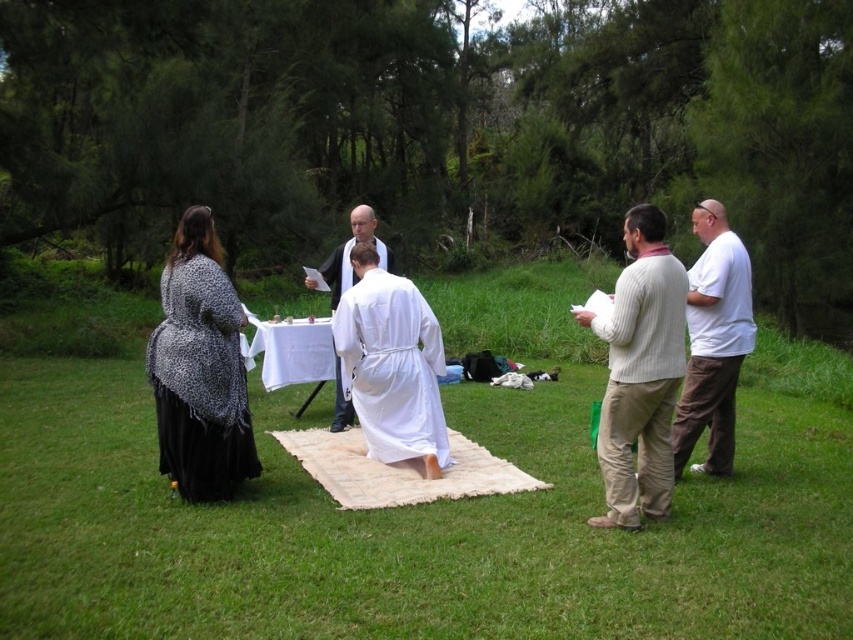
Can you confirm if white silk robe at center is wider than white clothed figure at center?

Indeed, white silk robe at center has a greater width compared to white clothed figure at center.

Can you confirm if white silk robe at center is bigger than white clothed figure at center?

Actually, white silk robe at center might be smaller than white clothed figure at center.

Is point (399, 356) positioned after point (372, 225)?

No, (399, 356) is in front of (372, 225).

Find the location of a particular element. This screenshot has width=853, height=640. white silk robe at center is located at coordinates (392, 368).

Which of these two, white sweater at right or white clothed figure at center, stands shorter?

Standing shorter between the two is white sweater at right.

Can you confirm if white sweater at right is positioned to the right of white clothed figure at center?

Yes, white sweater at right is to the right of white clothed figure at center.

Is point (619, 381) more distant than point (376, 241)?

No, (619, 381) is closer to viewer.

Locate an element on the screen. The height and width of the screenshot is (640, 853). white sweater at right is located at coordinates (640, 372).

Who is taller, white sweater at right or white silk robe at center?

With more height is white silk robe at center.

Can you confirm if white sweater at right is bigger than white silk robe at center?

Actually, white sweater at right might be smaller than white silk robe at center.

Is point (662, 401) positioned after point (393, 371)?

No.

Where is `white sweater at right`? This screenshot has height=640, width=853. white sweater at right is located at coordinates (640, 372).